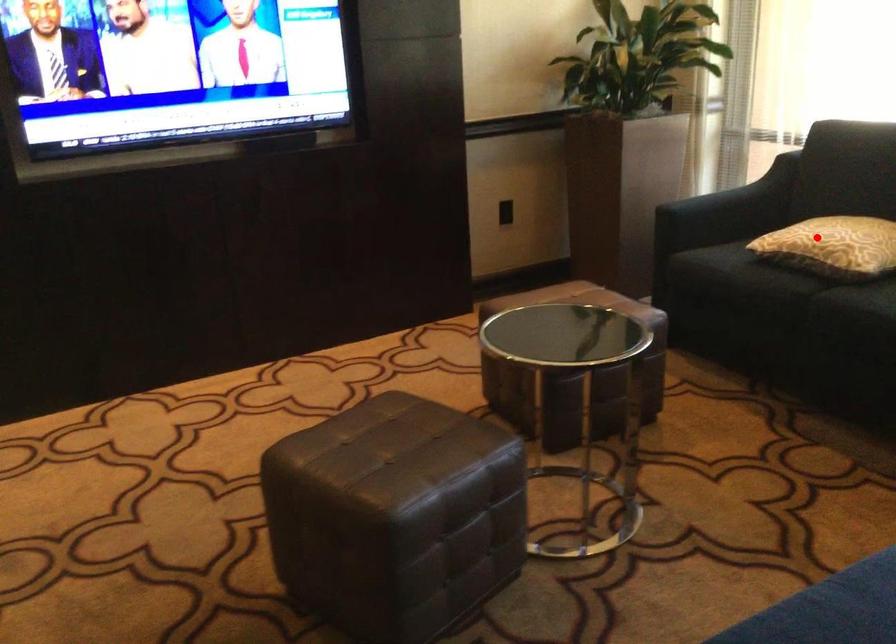
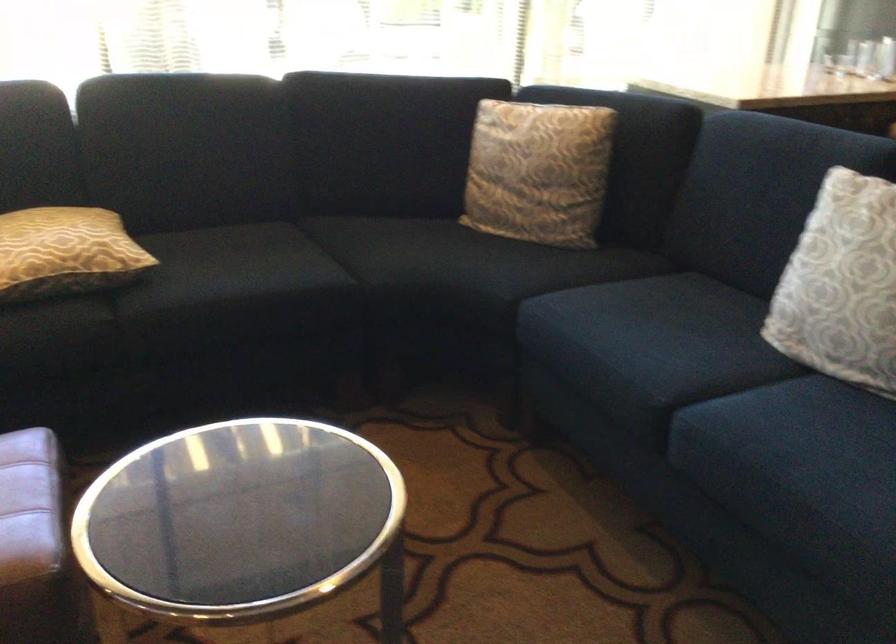
Question: A red point is marked in image1. In image2, is the corresponding 3D point closer to the camera or farther? Reply with the corresponding letter.

Choices:
 (A) The corresponding 3D point is closer.
 (B) The corresponding 3D point is farther.

Answer: (A)